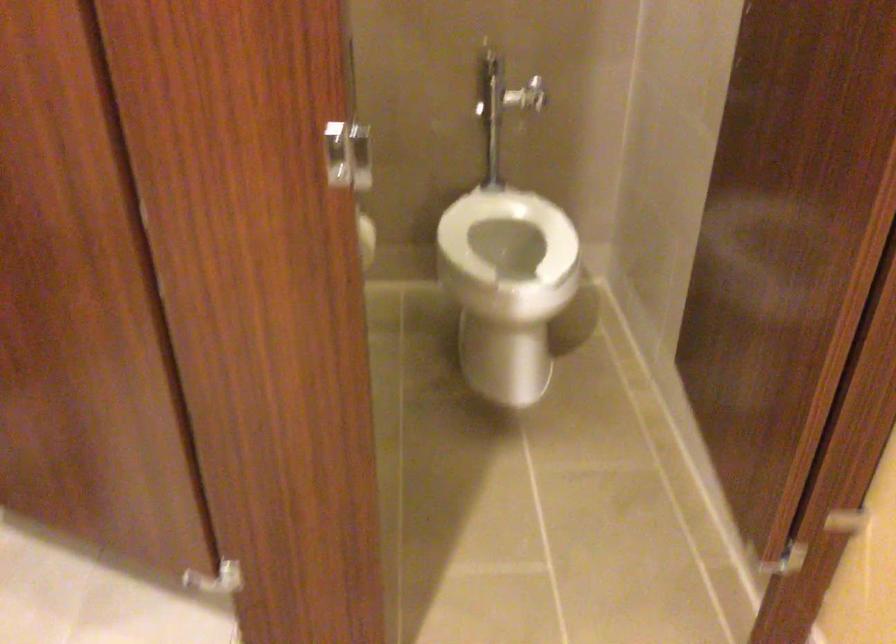
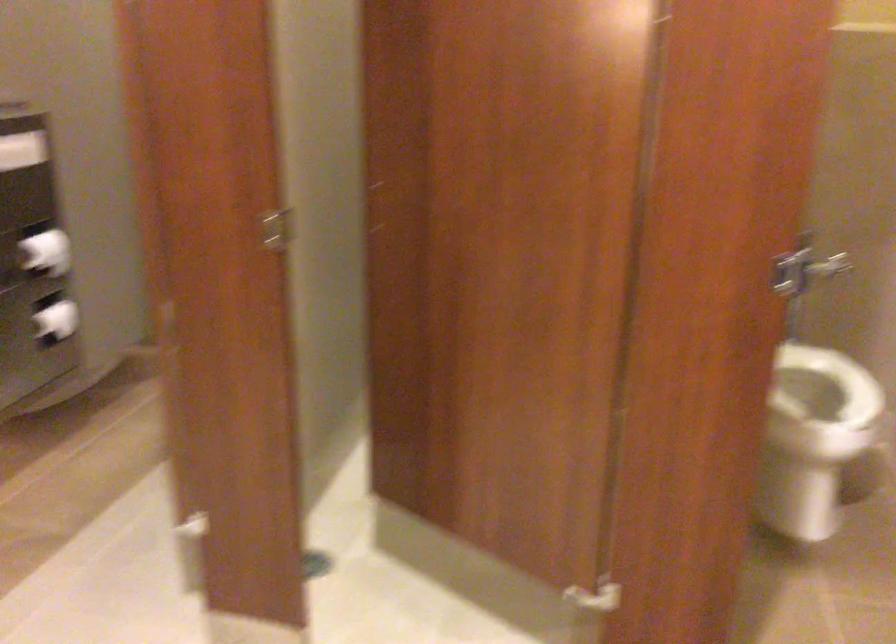
From the picture: In a continuous first-person perspective shot, in which direction is the camera moving?

The cameraman walked toward left, backward.